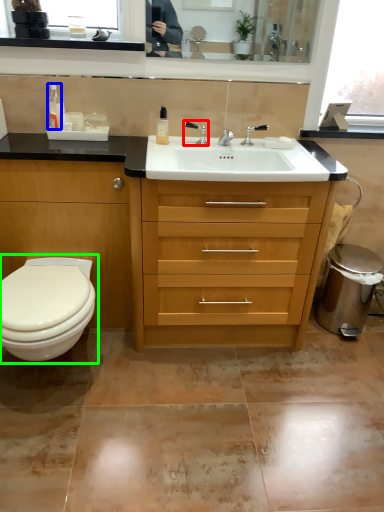
Question: Which object is positioned farthest from faucet (highlighted by a red box)? Select from toiletry (highlighted by a blue box) and toilet (highlighted by a green box).

Choices:
 (A) toiletry
 (B) toilet

Answer: (B)